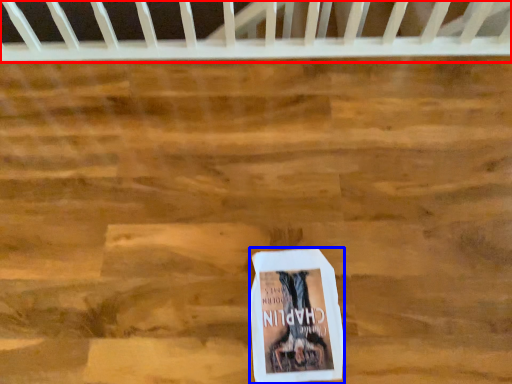
Question: Which of the following is the closest to the observer, infant bed (highlighted by a red box) or book (highlighted by a blue box)?

Choices:
 (A) infant bed
 (B) book

Answer: (B)